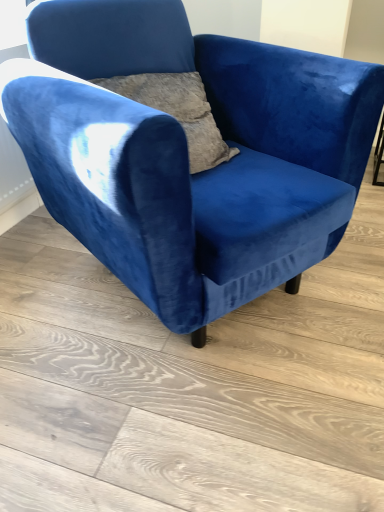
Where is `free space in front of velvet blue armchair at center`? This screenshot has height=512, width=384. free space in front of velvet blue armchair at center is located at coordinates (195, 416).